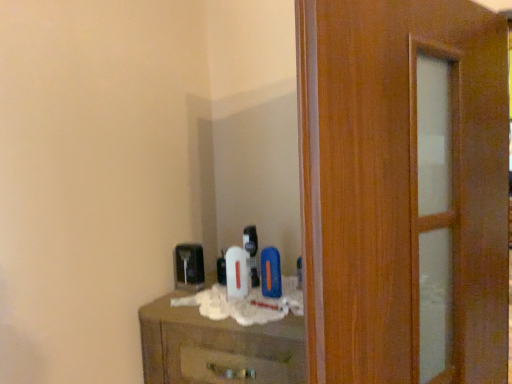
Where is `brown wood chest of drawers at center`? The width and height of the screenshot is (512, 384). brown wood chest of drawers at center is located at coordinates (217, 347).

The width and height of the screenshot is (512, 384). Describe the element at coordinates (217, 347) in the screenshot. I see `brown wood chest of drawers at center` at that location.

The width and height of the screenshot is (512, 384). I want to click on brown wood chest of drawers at center, so tap(217, 347).